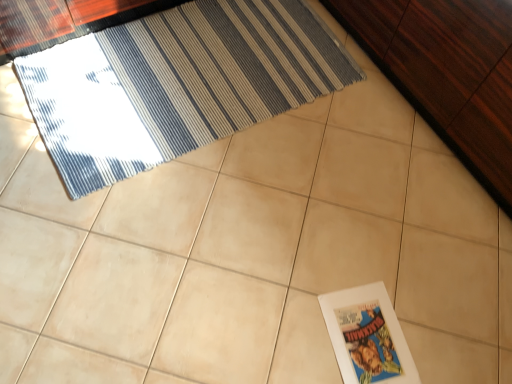
You are a GUI agent. You are given a task and a screenshot of the screen. Output one action in this format:
    pyautogui.click(x=<x>, y=<y>)
    Task: Click on the vacant space to the right of white paper at lower right
    
    Given the screenshot: What is the action you would take?
    pyautogui.click(x=446, y=332)